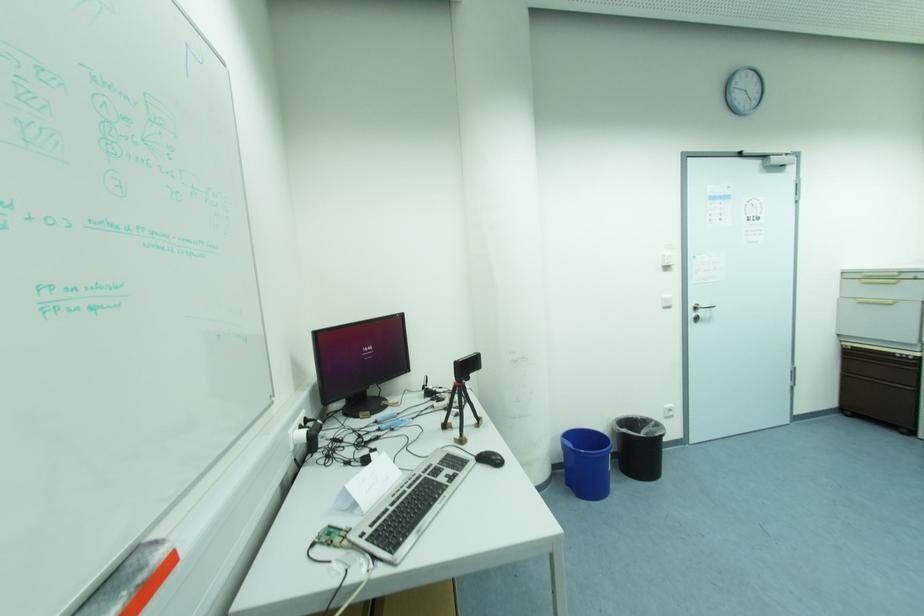
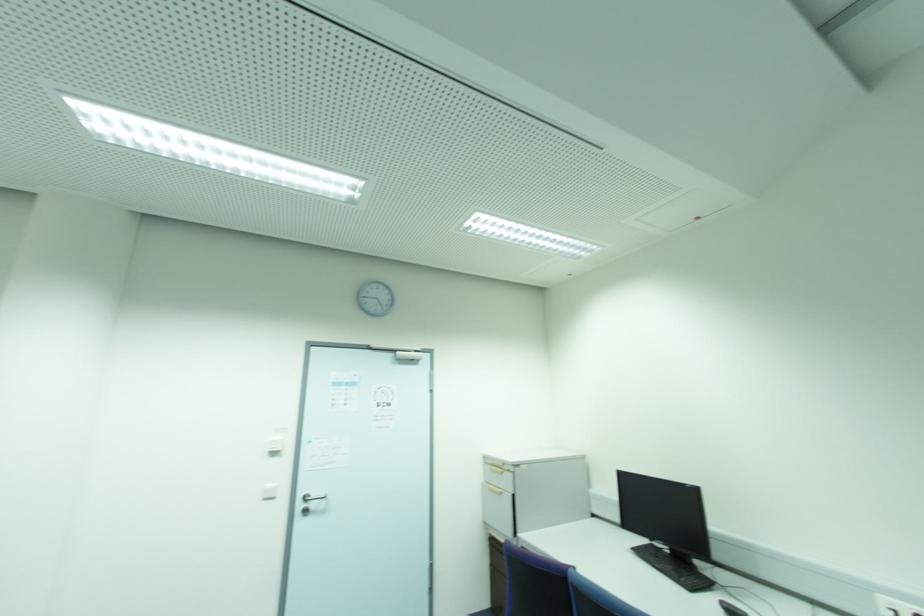
The point at [669,269] is marked in the first image. Where is the corresponding point in the second image?

(274, 454)